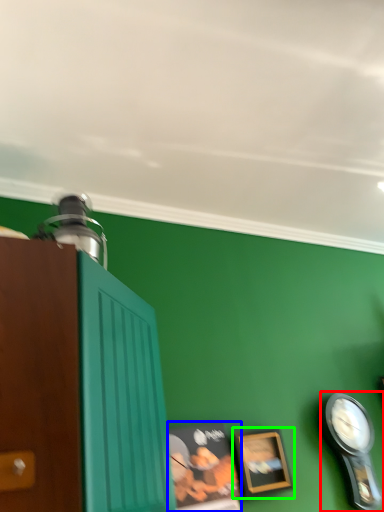
Question: Which object is the farthest from clock (highlighted by a red box)? Choose among these: picture frame (highlighted by a blue box) or picture frame (highlighted by a green box).

Choices:
 (A) picture frame
 (B) picture frame

Answer: (A)